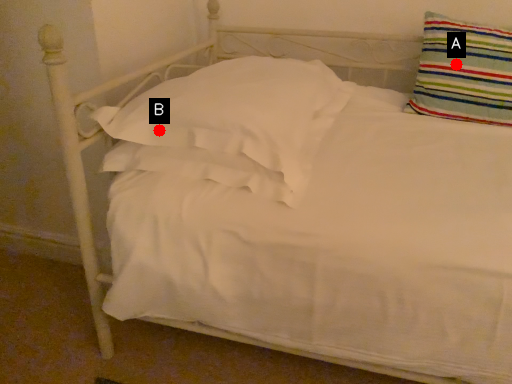
Question: Two points are circled on the image, labeled by A and B beside each circle. Which point is closer to the camera?

Choices:
 (A) A is closer
 (B) B is closer

Answer: (B)